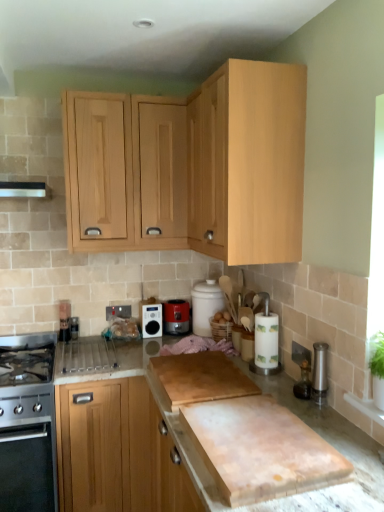
Question: Is light wood cabinet at lower left, positioned as the 1th cabinetry in bottom-to-top order, taller or shorter than metallic silver toaster at lower left?

Choices:
 (A) tall
 (B) short

Answer: (A)

Question: Considering the positions of light wood cabinet at lower left, positioned as the 1th cabinetry in bottom-to-top order, and metallic silver toaster at lower left in the image, is light wood cabinet at lower left, positioned as the 1th cabinetry in bottom-to-top order, bigger or smaller than metallic silver toaster at lower left?

Choices:
 (A) small
 (B) big

Answer: (B)

Question: Which is farther from the light wood cabinet at upper center, the fourth cabinetry in the bottom-to-top sequence?

Choices:
 (A) stainless steel oven at left, which is counted as the 3th kitchen appliance, starting from the top
 (B) light wood cabinet at lower left, positioned as the 1th cabinetry in bottom-to-top order
 (C) matte black radio at center, the 2th kitchen appliance when ordered from bottom to top
 (D) metallic silver toaster at lower left
 (E) light wood cabinet at upper center, the 3th cabinetry from the top

Answer: (B)

Question: Which object is positioned farthest from the light wood cabinet at lower left, the 4th cabinetry viewed from the top?

Choices:
 (A) matte black radio at center, the 2th kitchen appliance when ordered from bottom to top
 (B) matte red toaster at center, which ranks as the third kitchen appliance in left-to-right order
 (C) metallic silver toaster at lower left
 (D) stainless steel oven at left, acting as the 1th kitchen appliance starting from the left
 (E) natural wood cabinet at upper center, the 3th cabinetry ordered from the bottom

Answer: (E)